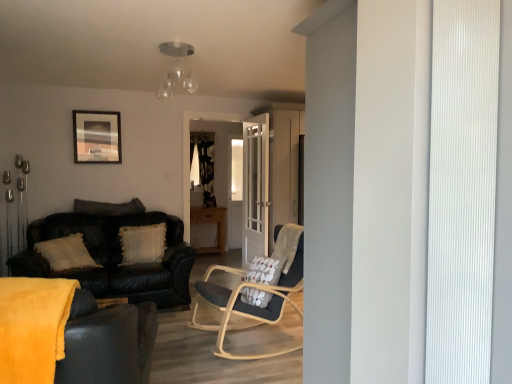
Question: Can we say wooden side table at lower left lies outside light brown wooden table at center?

Choices:
 (A) yes
 (B) no

Answer: (A)

Question: Considering the relative positions of wooden side table at lower left and light brown wooden table at center in the image provided, is wooden side table at lower left to the left of light brown wooden table at center from the viewer's perspective?

Choices:
 (A) no
 (B) yes

Answer: (B)

Question: Can you confirm if wooden side table at lower left is smaller than light brown wooden table at center?

Choices:
 (A) no
 (B) yes

Answer: (B)

Question: Does wooden side table at lower left have a lesser height compared to light brown wooden table at center?

Choices:
 (A) yes
 (B) no

Answer: (A)

Question: Considering the relative sizes of wooden side table at lower left and light brown wooden table at center in the image provided, is wooden side table at lower left bigger than light brown wooden table at center?

Choices:
 (A) yes
 (B) no

Answer: (B)

Question: Is wooden side table at lower left positioned far away from light brown wooden table at center?

Choices:
 (A) yes
 (B) no

Answer: (A)

Question: Is wooden side table at lower left surrounding wooden picture frame at upper left?

Choices:
 (A) no
 (B) yes

Answer: (A)

Question: Considering the relative sizes of wooden side table at lower left and wooden picture frame at upper left in the image provided, is wooden side table at lower left smaller than wooden picture frame at upper left?

Choices:
 (A) yes
 (B) no

Answer: (A)

Question: Is wooden side table at lower left thinner than wooden picture frame at upper left?

Choices:
 (A) no
 (B) yes

Answer: (A)

Question: From a real-world perspective, is wooden side table at lower left on top of wooden picture frame at upper left?

Choices:
 (A) no
 (B) yes

Answer: (A)

Question: Is wooden side table at lower left in front of wooden picture frame at upper left?

Choices:
 (A) yes
 (B) no

Answer: (A)

Question: From the image's perspective, does wooden side table at lower left appear higher than wooden picture frame at upper left?

Choices:
 (A) yes
 (B) no

Answer: (B)

Question: Does wooden picture frame at upper left have a smaller size compared to white textured pillow at left, the first pillow from the top?

Choices:
 (A) no
 (B) yes

Answer: (B)